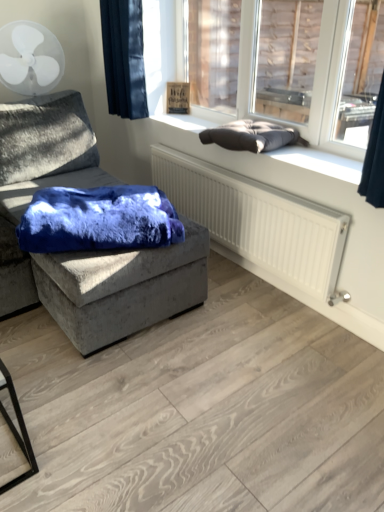
Locate an element on the screen. blue fuzzy blanket at center is located at coordinates (99, 220).

Where is `dark gray fabric cushion at upper right`? The width and height of the screenshot is (384, 512). dark gray fabric cushion at upper right is located at coordinates (251, 136).

The height and width of the screenshot is (512, 384). Describe the element at coordinates (124, 57) in the screenshot. I see `dark blue fabric at upper left` at that location.

Measure the distance between dark gray cushion at upper right and camera.

The depth of dark gray cushion at upper right is 10.86 feet.

Find the location of a particular element. The image size is (384, 512). velvet gray studio couch at left is located at coordinates (98, 248).

Measure the distance between velvet gray studio couch at left and camera.

velvet gray studio couch at left and camera are 1.59 meters apart from each other.

This screenshot has height=512, width=384. I want to click on blue fuzzy blanket at center, so coord(99,220).

How different are the orientations of white plastic mechanical fan at upper left and dark gray fabric cushion at upper right in degrees?

63.4 degrees separate the facing orientations of white plastic mechanical fan at upper left and dark gray fabric cushion at upper right.

Based on the photo, is white plastic mechanical fan at upper left beside dark gray fabric cushion at upper right?

There is a gap between white plastic mechanical fan at upper left and dark gray fabric cushion at upper right.

From a real-world perspective, is white plastic mechanical fan at upper left beneath dark gray fabric cushion at upper right?

Actually, white plastic mechanical fan at upper left is physically above dark gray fabric cushion at upper right in the real world.

Considering the sizes of objects dark gray cushion at upper right and dark gray fabric cushion at upper right in the image provided, who is thinner, dark gray cushion at upper right or dark gray fabric cushion at upper right?

Thinner between the two is dark gray cushion at upper right.

Is point (367, 141) closer to viewer compared to point (269, 147)?

No, (367, 141) is behind (269, 147).

From the picture: Is dark gray fabric cushion at upper right surrounded by dark gray cushion at upper right?

→ No, dark gray fabric cushion at upper right is not inside dark gray cushion at upper right.

Is blue fuzzy blanket at center to the left or to the right of dark blue fabric at upper left in the image?

blue fuzzy blanket at center is positioned on dark blue fabric at upper left's right side.

Which object is closer to the camera taking this photo, blue fuzzy blanket at center or dark blue fabric at upper left?

blue fuzzy blanket at center is in front.

Is blue fuzzy blanket at center positioned with its back to dark blue fabric at upper left?

That's not correct — blue fuzzy blanket at center is not looking away from dark blue fabric at upper left.

Is blue fuzzy blanket at center bigger than dark blue fabric at upper left?

Correct, blue fuzzy blanket at center is larger in size than dark blue fabric at upper left.

How many degrees apart are the facing directions of blue fuzzy blanket at center and dark gray fabric cushion at upper right?

There is a 58.2-degree angle between the facing directions of blue fuzzy blanket at center and dark gray fabric cushion at upper right.

At what (x,y) coordinates should I click in order to perform the action: click on material below the dark gray fabric cushion at upper right (from the image's perspective). Please return your answer as a coordinate pair (x, y). Looking at the image, I should click on (99, 220).

Is blue fuzzy blanket at center looking in the opposite direction of dark gray fabric cushion at upper right?

blue fuzzy blanket at center is not turned away from dark gray fabric cushion at upper right.

Who is shorter, blue fuzzy blanket at center or dark gray fabric cushion at upper right?

dark gray fabric cushion at upper right.

Consider the image. Is dark gray cushion at upper right bigger or smaller than white plastic mechanical fan at upper left?

dark gray cushion at upper right is smaller than white plastic mechanical fan at upper left.

Which object is thinner, dark gray cushion at upper right or white plastic mechanical fan at upper left?

With smaller width is dark gray cushion at upper right.

Considering the relative positions of dark gray cushion at upper right and white plastic mechanical fan at upper left in the image provided, is dark gray cushion at upper right to the left of white plastic mechanical fan at upper left from the viewer's perspective?

Incorrect, dark gray cushion at upper right is not on the left side of white plastic mechanical fan at upper left.

Is dark gray cushion at upper right in front of or behind white plastic mechanical fan at upper left in the image?

Visually, dark gray cushion at upper right is located in front of white plastic mechanical fan at upper left.

Is velvet gray studio couch at left turned away from white plastic mechanical fan at upper left?

No, velvet gray studio couch at left's orientation is not away from white plastic mechanical fan at upper left.

In the image, there is a white plastic mechanical fan at upper left. Identify the location of studio couch below it (from the image's perspective). The height and width of the screenshot is (512, 384). (98, 248).

Considering the sizes of objects dark gray fabric cushion at upper right and velvet gray studio couch at left in the image provided, who is taller, dark gray fabric cushion at upper right or velvet gray studio couch at left?

Standing taller between the two is velvet gray studio couch at left.

Find the location of `blanket above the velvet gray studio couch at left (from a real-world perspective)`. blanket above the velvet gray studio couch at left (from a real-world perspective) is located at coordinates (251, 136).

How different are the orientations of dark gray fabric cushion at upper right and velvet gray studio couch at left in degrees?

There is a 82.6-degree angle between the facing directions of dark gray fabric cushion at upper right and velvet gray studio couch at left.

Considering the positions of objects dark gray fabric cushion at upper right and velvet gray studio couch at left in the image provided, who is more to the right, dark gray fabric cushion at upper right or velvet gray studio couch at left?

dark gray fabric cushion at upper right is more to the right.

Find the location of a particular element. The height and width of the screenshot is (512, 384). mechanical fan on the left of dark gray fabric cushion at upper right is located at coordinates (30, 58).

The height and width of the screenshot is (512, 384). I want to click on blanket behind the dark gray cushion at upper right, so click(x=251, y=136).

Based on their spatial positions, is dark gray fabric cushion at upper right or velvet gray studio couch at left further from dark gray cushion at upper right?

Based on the image, velvet gray studio couch at left appears to be further to dark gray cushion at upper right.

Which object lies nearer to the anchor point velvet gray studio couch at left, white plastic mechanical fan at upper left or dark gray cushion at upper right?

Based on the image, dark gray cushion at upper right appears to be nearer to velvet gray studio couch at left.

Looking at the image, which one is located further to white plastic mechanical fan at upper left, dark gray cushion at upper right or dark gray cushion at upper right?

dark gray cushion at upper right.

Considering their positions, is dark gray fabric cushion at upper right positioned further to velvet gray studio couch at left than dark gray cushion at upper right?

dark gray fabric cushion at upper right is positioned further to the anchor velvet gray studio couch at left.

From the image, which object appears to be nearer to dark gray cushion at upper right, velvet gray studio couch at left or white plastic mechanical fan at upper left?

Among the two, white plastic mechanical fan at upper left is located nearer to dark gray cushion at upper right.

From the image, which object appears to be farther from dark blue fabric at upper left, dark gray fabric cushion at upper right or blue fuzzy blanket at center?

blue fuzzy blanket at center.

Looking at the image, which one is located further to dark gray cushion at upper right, blue fuzzy blanket at center or dark gray fabric cushion at upper right?

blue fuzzy blanket at center.

When comparing their distances from dark gray cushion at upper right, does blue fuzzy blanket at center or velvet gray studio couch at left seem further?

blue fuzzy blanket at center is further to dark gray cushion at upper right.

Locate an element on the screen. The height and width of the screenshot is (512, 384). window sill between dark blue fabric at upper left and dark gray cushion at upper right from left to right is located at coordinates (257, 155).

Identify the location of window sill between dark gray cushion at upper right and dark gray fabric cushion at upper right from top to bottom. The image size is (384, 512). 257,155.

Locate an element on the screen. studio couch located between white plastic mechanical fan at upper left and dark gray cushion at upper right in the left-right direction is located at coordinates [x=98, y=248].

Where is `blanket situated between dark blue fabric at upper left and dark gray cushion at upper right from left to right`? blanket situated between dark blue fabric at upper left and dark gray cushion at upper right from left to right is located at coordinates (251, 136).